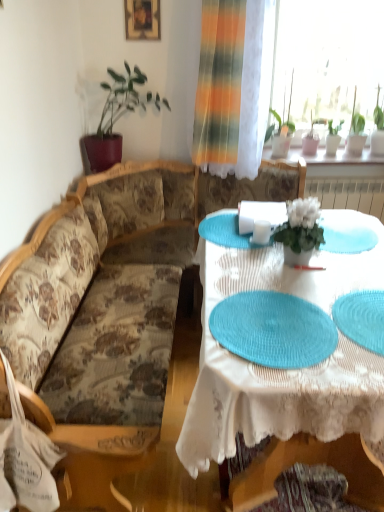
What are the coordinates of `free spot above teal woven placemat at center (from a real-world perspective)` in the screenshot? It's located at (266, 318).